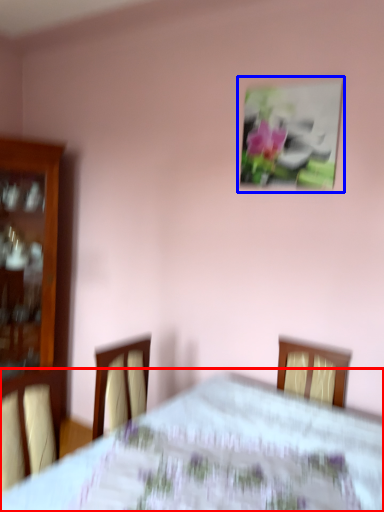
Question: Which of the following is the closest to the observer, bed (highlighted by a red box) or picture frame (highlighted by a blue box)?

Choices:
 (A) bed
 (B) picture frame

Answer: (A)